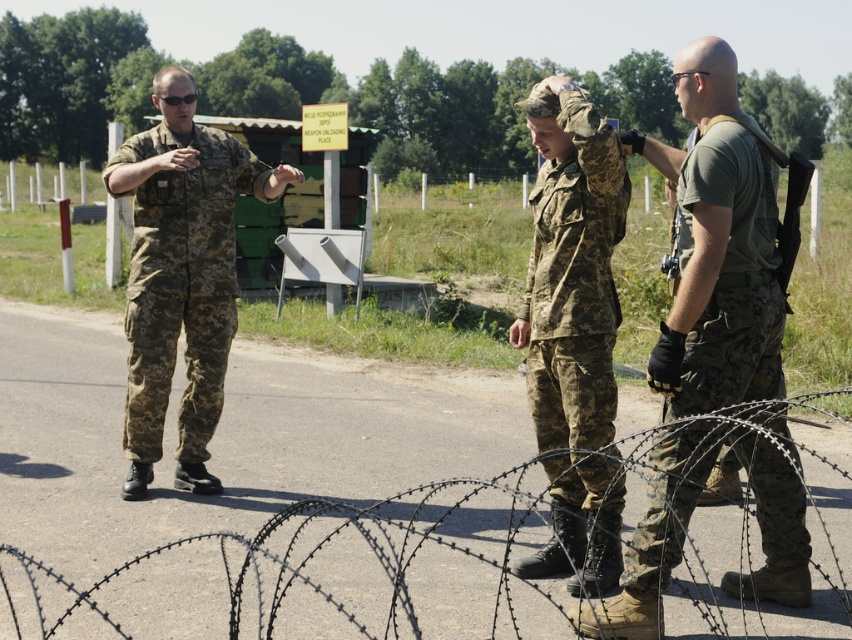
You are a hiker who wants to cross the road safely. There is a barbed wire at center and a camouflage fabric uniform at left in the image. Which object should you avoid stepping on to stay safe?

The barbed wire at center is to the right of camouflage fabric uniform at left. Barbed wire is typically dangerous due to its sharp points, so you should avoid stepping on the barbed wire at center to stay safe.

You are a photographer trying to capture a group photo of the camouflage uniform at center and the camouflage fabric uniform at center. The camera you are using has a minimum focusing distance of 16 inches. Can you take a clear photo of both subjects without moving them?

The camouflage uniform at center and the camouflage fabric uniform at center are 18.05 inches apart, which is beyond the camera minimum focusing distance of 16 inches. Therefore, you can take a clear photo of both subjects without moving them.

You are a hiker who wants to cross the road but notices the barbed wire at center and the camouflage fabric uniform at left. Which object is positioned lower in the scene?

The barbed wire at center is positioned lower than the camouflage fabric uniform at left.